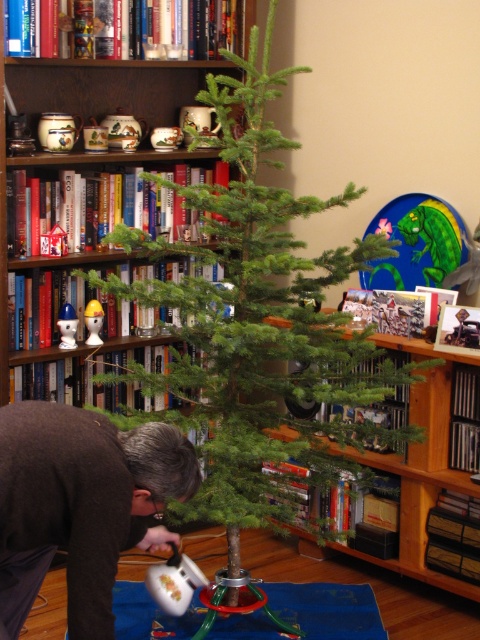
Can you confirm if brown wooden bookcase at center is bigger than wooden bookshelf at center?

Yes, brown wooden bookcase at center is bigger than wooden bookshelf at center.

Can you confirm if brown wooden bookcase at center is shorter than wooden bookshelf at center?

No.

At what (x,y) coordinates should I click in order to perform the action: click on brown wooden bookcase at center. Please return your answer as a coordinate pair (x, y). Looking at the image, I should click on (132, 67).

Find the location of a particular element. brown wooden bookcase at center is located at coordinates (132, 67).

Is the position of green matte christmas tree at center more distant than that of matte white plastic toy at center?

No.

Can you confirm if green matte christmas tree at center is smaller than matte white plastic toy at center?

Actually, green matte christmas tree at center might be larger than matte white plastic toy at center.

Does point (177, 410) come in front of point (96, 300)?

Yes.

Where is `green matte christmas tree at center`? This screenshot has height=640, width=480. green matte christmas tree at center is located at coordinates (260, 321).

Which of these two, brown wool sweater at lower left or brown wooden bookcase at center, stands shorter?

brown wool sweater at lower left is shorter.

Who is taller, brown wool sweater at lower left or brown wooden bookcase at center?

Standing taller between the two is brown wooden bookcase at center.

You are a GUI agent. You are given a task and a screenshot of the screen. Output one action in this format:
    pyautogui.click(x=<x>, y=<y>)
    Task: Click on the brown wool sweater at lower left
    Image resolution: width=480 pixels, height=640 pixels.
    Given the screenshot: What is the action you would take?
    pyautogui.click(x=81, y=504)

The image size is (480, 640). Identify the location of brown wool sweater at lower left. (81, 504).